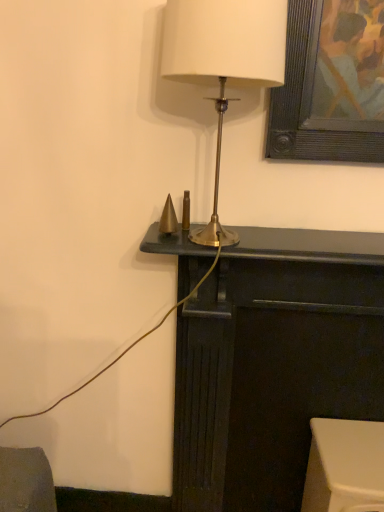
Question: Visually, is white plastic stool at lower right, the 1th furniture from the right, positioned to the left or to the right of dark wood fireplace at center, which ranks as the first furniture in left-to-right order?

Choices:
 (A) left
 (B) right

Answer: (B)

Question: From the image's perspective, is white plastic stool at lower right, the 1th furniture from the right, located above or below dark wood fireplace at center, the 2th furniture when ordered from right to left?

Choices:
 (A) above
 (B) below

Answer: (B)

Question: Which object is the closest to the white plastic stool at lower right, placed as the 2th furniture when sorted from left to right?

Choices:
 (A) dark wood fireplace at center, which ranks as the first furniture in left-to-right order
 (B) matte gold lamp at center

Answer: (A)

Question: Which object is positioned farthest from the dark wood fireplace at center, the 2th furniture when ordered from right to left?

Choices:
 (A) matte gold lamp at center
 (B) white plastic stool at lower right, placed as the 2th furniture when sorted from left to right

Answer: (A)